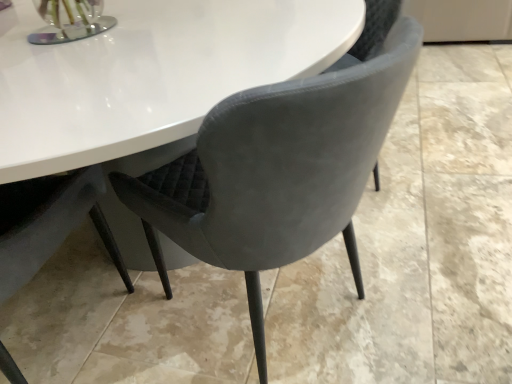
Where is `vacant space underneath velvet grey chair at center (from a real-world perspective)`? The image size is (512, 384). vacant space underneath velvet grey chair at center (from a real-world perspective) is located at coordinates (280, 312).